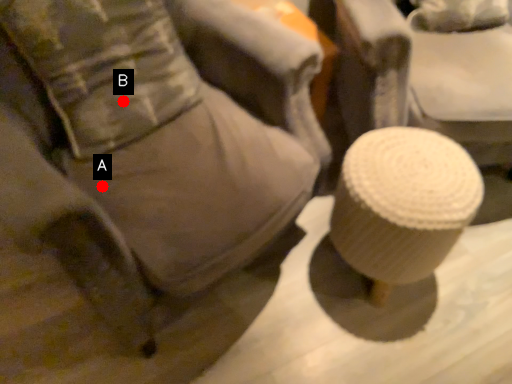
Question: Two points are circled on the image, labeled by A and B beside each circle. Among these points, which one is farthest from the camera?

Choices:
 (A) A is further
 (B) B is further

Answer: (B)